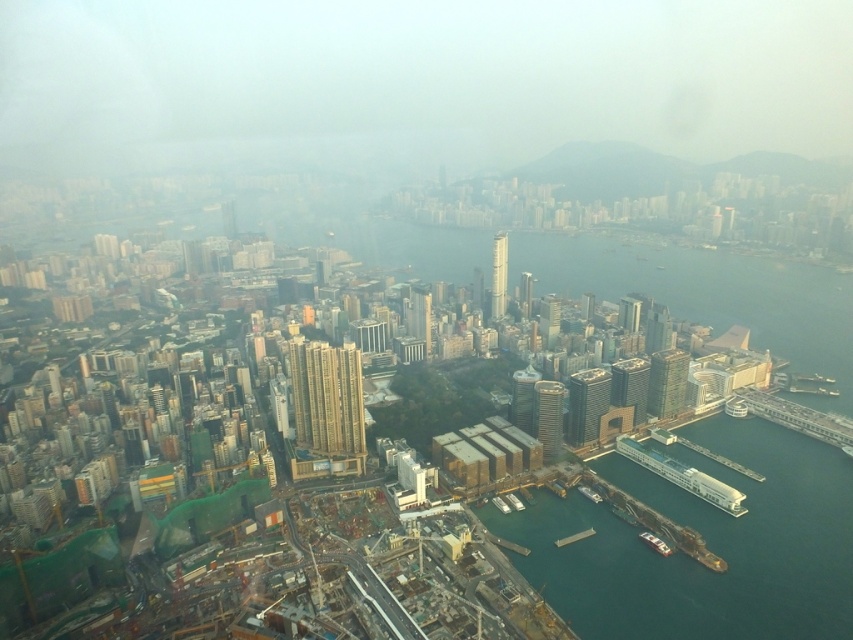
Question: Can you confirm if metallic gray boat at lower right is wider than white plastic dock at lower right?

Choices:
 (A) yes
 (B) no

Answer: (B)

Question: Which point appears farthest from the camera in this image?

Choices:
 (A) (665, 552)
 (B) (622, 28)

Answer: (B)

Question: Which of the following is the farthest from the observer?

Choices:
 (A) metallic gray boat at lower right
 (B) white plastic dock at lower right
 (C) white fog at center

Answer: (C)

Question: Does white fog at center appear under metallic gray boat at lower right?

Choices:
 (A) no
 (B) yes

Answer: (A)

Question: Which of the following is the farthest from the observer?

Choices:
 (A) (260, 109)
 (B) (570, 536)

Answer: (A)

Question: Does white fog at center appear on the right side of metallic gray boat at lower right?

Choices:
 (A) no
 (B) yes

Answer: (A)